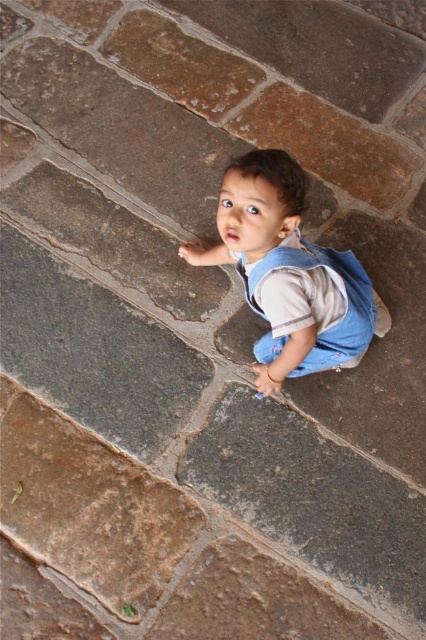
Does point (268, 321) lie in front of point (363, 280)?

That is False.

Is point (273, 328) positioned behind point (276, 264)?

Yes.

Identify the location of blue denim overalls at center. 287,273.